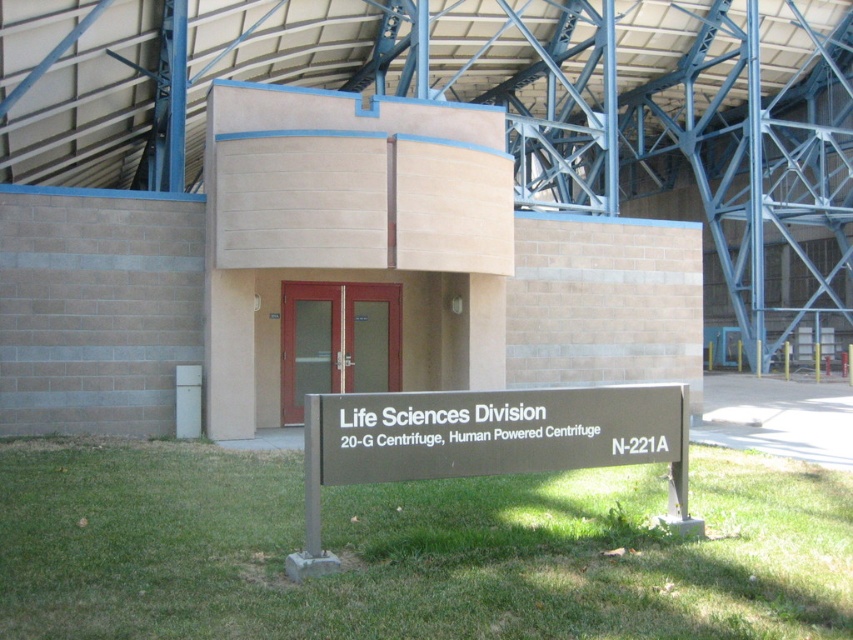
Question: From the image, what is the correct spatial relationship of green grass at lower center in relation to brown metal sign at center?

Choices:
 (A) left
 (B) right

Answer: (A)

Question: Which point is closer to the camera taking this photo?

Choices:
 (A) (386, 477)
 (B) (36, 474)

Answer: (A)

Question: Is green grass at lower center below brown metal sign at center?

Choices:
 (A) no
 (B) yes

Answer: (B)

Question: Which of the following is the closest to the observer?

Choices:
 (A) (91, 499)
 (B) (465, 408)

Answer: (B)

Question: Is the position of green grass at lower center more distant than that of brown metal sign at center?

Choices:
 (A) no
 (B) yes

Answer: (B)